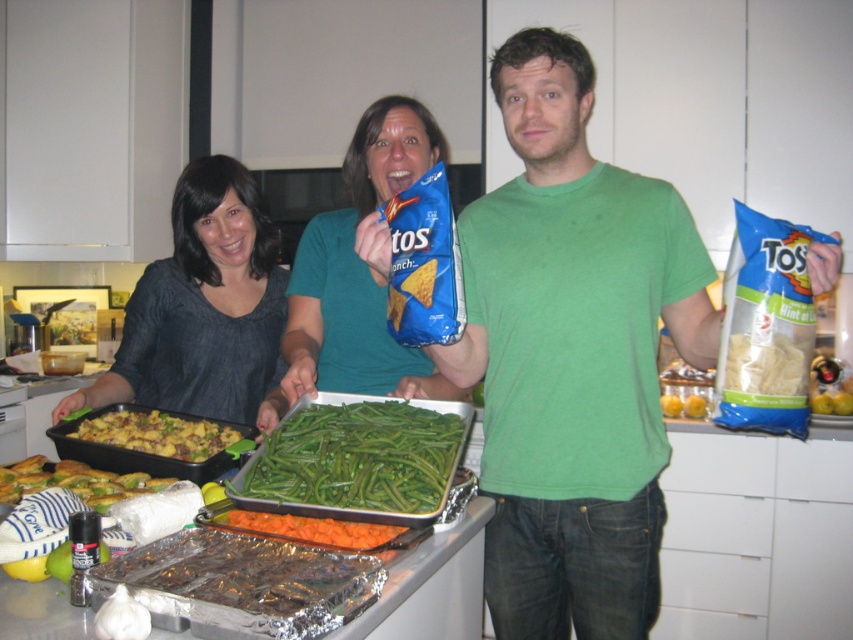
What is located at the coordinates point (160, 433) in the image?

The point (160, 433) corresponds to the golden brown crumbly mixture at center.

You are a chef organizing a buffet table. You have the golden brown crumbly mixture at center and the green matte broccoli at lower left. Where should you place each dish so that the broccoli is easily visible to guests approaching from the front of the table? Explain your reasoning.

Place the green matte broccoli at lower left on the lower shelf or front section of the buffet table and position the golden brown crumbly mixture at center above it. Since the golden brown crumbly mixture at center is located above the green matte broccoli at lower left, arranging them this way ensures the broccoli remains visible to guests approaching from the front while maintaining their spatial relationship.

Based on the scene described, which object takes up more horizontal space between the golden brown crumbly mixture at center and the green matte broccoli at lower left?

The golden brown crumbly mixture at center takes up more horizontal space because its width is larger than the green matte broccoli at lower left.